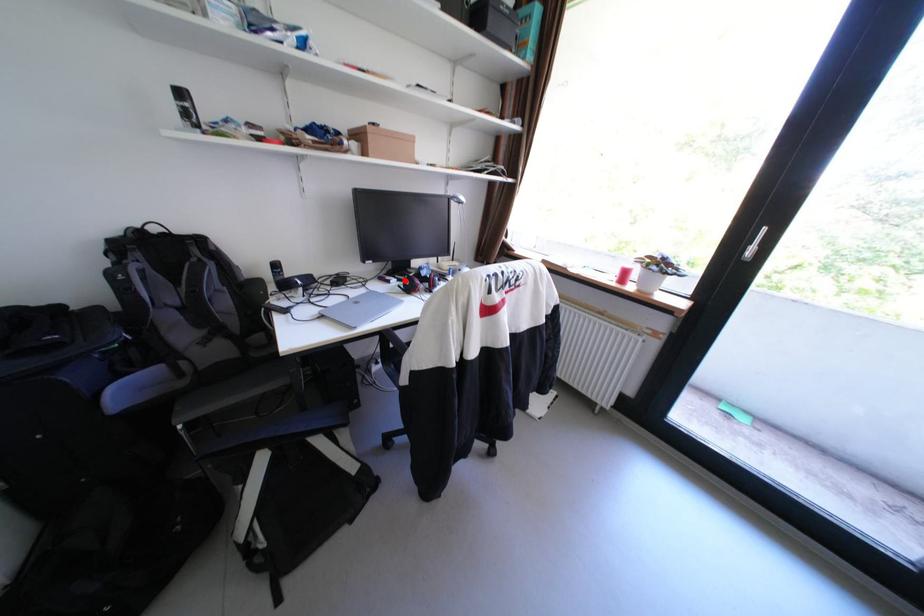
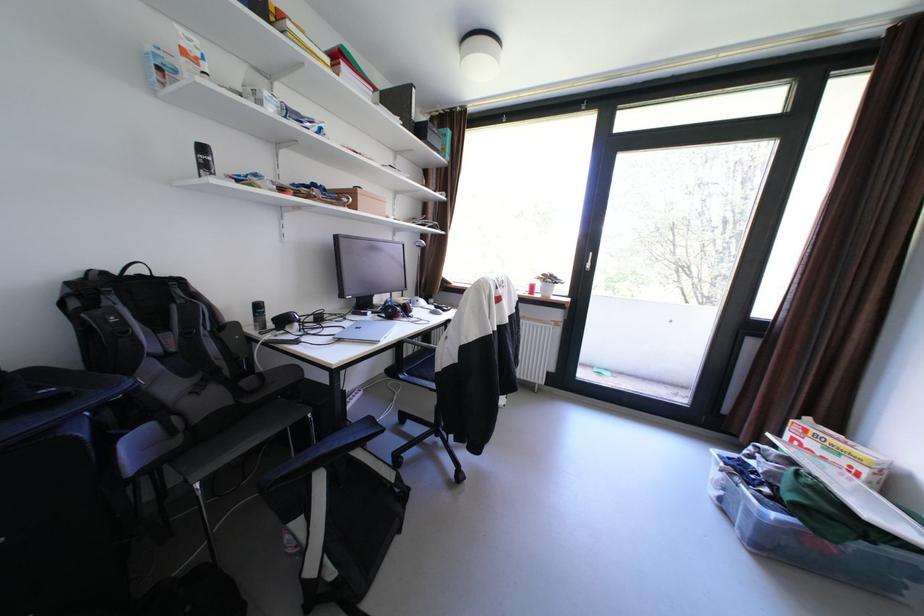
Where in the second image is the point corresponding to the highlighted location from the first image?

(380, 313)